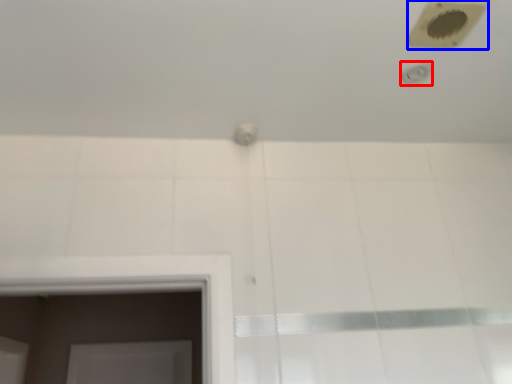
Question: Which object is closer to the camera taking this photo, shower (highlighted by a red box) or hole (highlighted by a blue box)?

Choices:
 (A) shower
 (B) hole

Answer: (B)